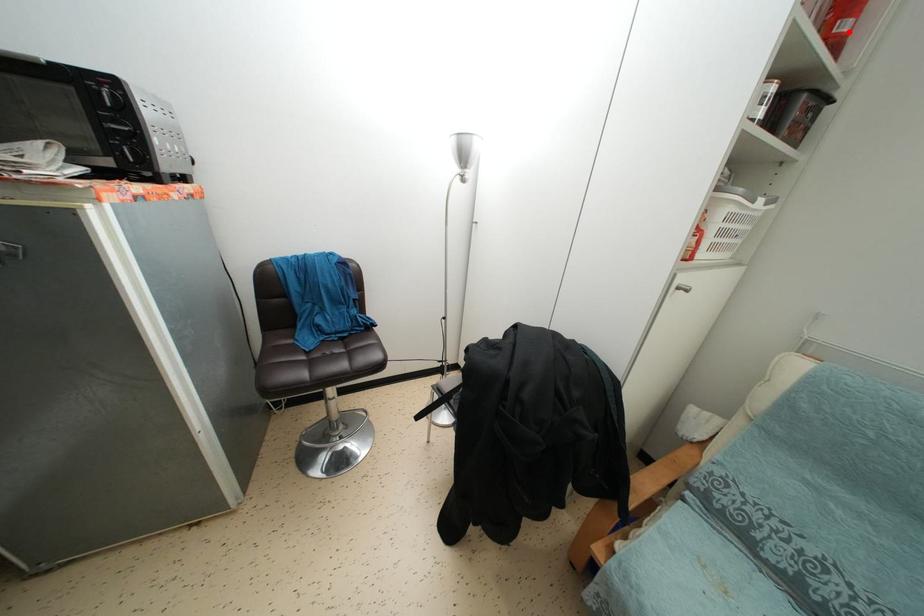
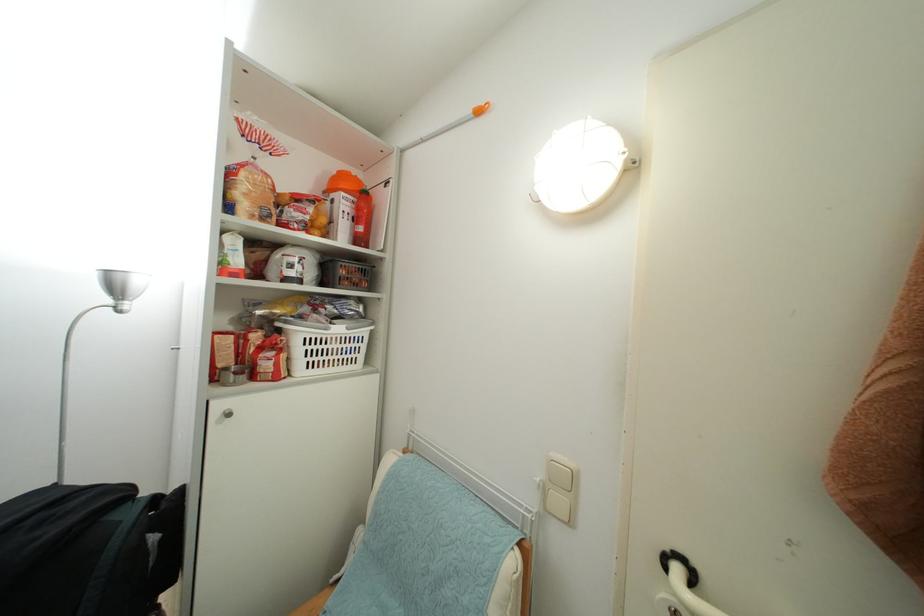
Locate, in the second image, the point that corresponds to the highlighted location in the first image.

(365, 235)